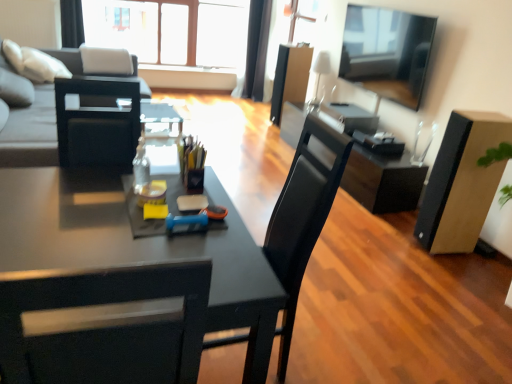
Question: Is translucent glass bottle at center bigger than matte black desk at center?

Choices:
 (A) yes
 (B) no

Answer: (B)

Question: From a real-world perspective, is translucent glass bottle at center below matte black desk at center?

Choices:
 (A) no
 (B) yes

Answer: (A)

Question: Could you tell me if translucent glass bottle at center is facing matte black desk at center?

Choices:
 (A) no
 (B) yes

Answer: (A)

Question: Is translucent glass bottle at center shorter than matte black desk at center?

Choices:
 (A) yes
 (B) no

Answer: (A)

Question: Is translucent glass bottle at center positioned far away from matte black desk at center?

Choices:
 (A) no
 (B) yes

Answer: (A)

Question: Is point (276, 112) closer or farther from the camera than point (64, 43)?

Choices:
 (A) farther
 (B) closer

Answer: (B)

Question: Would you say matte black box at center, which is counted as the first box, starting from the top, is inside or outside black fabric curtain at upper left, positioned as the 2th curtain in back-to-front order?

Choices:
 (A) outside
 (B) inside

Answer: (A)

Question: From the image's perspective, is matte black box at center, the 1th box viewed from the back, above or below black fabric curtain at upper left, the first curtain when ordered from left to right?

Choices:
 (A) below
 (B) above

Answer: (A)

Question: Visually, is matte black box at center, which appears as the 2th box when viewed from the right, positioned to the left or to the right of black fabric curtain at upper left, which is counted as the 1th curtain, starting from the front?

Choices:
 (A) left
 (B) right

Answer: (B)

Question: Which is correct: translucent glass bottle at center is inside black glossy computer desk at center, or outside of it?

Choices:
 (A) outside
 (B) inside

Answer: (A)

Question: Would you say translucent glass bottle at center is to the left or to the right of black glossy computer desk at center in the picture?

Choices:
 (A) left
 (B) right

Answer: (A)

Question: From the image's perspective, is translucent glass bottle at center above or below black glossy computer desk at center?

Choices:
 (A) above
 (B) below

Answer: (B)

Question: In terms of size, does translucent glass bottle at center appear bigger or smaller than black glossy computer desk at center?

Choices:
 (A) small
 (B) big

Answer: (A)

Question: Looking at their shapes, would you say flat screen tv at upper right is wider or thinner than gray fabric couch at upper left?

Choices:
 (A) thin
 (B) wide

Answer: (A)

Question: Looking at the image, does flat screen tv at upper right seem bigger or smaller compared to gray fabric couch at upper left?

Choices:
 (A) big
 (B) small

Answer: (B)